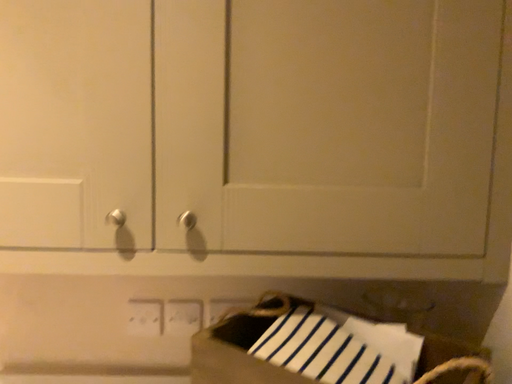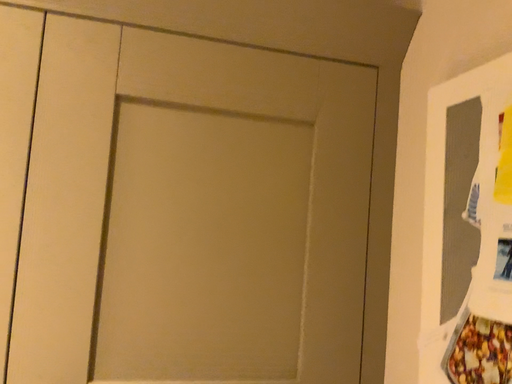
Question: Which way did the camera rotate in the video?

Choices:
 (A) rotated left
 (B) rotated right

Answer: (B)